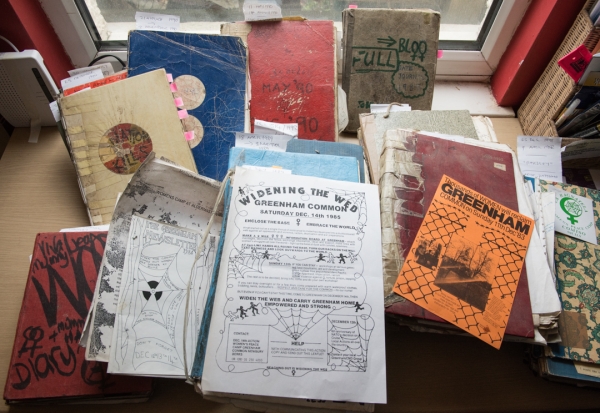
Where is `window glass`? This screenshot has width=600, height=413. window glass is located at coordinates (x=457, y=17).